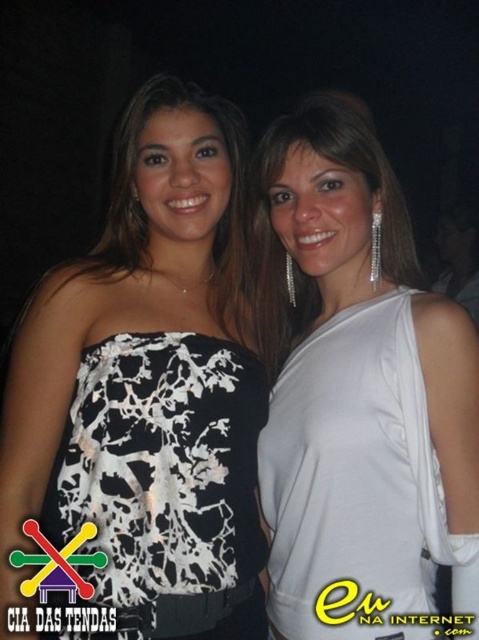
In the scene shown: Which of these two, white printed dress at center or white satin dress at center, stands shorter?

white satin dress at center is shorter.

Does white printed dress at center have a lesser height compared to white satin dress at center?

Incorrect, white printed dress at center's height does not fall short of white satin dress at center's.

Between point (59, 451) and point (269, 266), which one is positioned in front?

Positioned in front is point (59, 451).

The height and width of the screenshot is (640, 479). Identify the location of white printed dress at center. (146, 396).

Is white printed dress at center thinner than white printed dress at left?

No.

Is point (34, 349) positioned behind point (133, 220)?

No, (34, 349) is in front of (133, 220).

Is point (214, 108) behind point (162, 224)?

That is True.

Locate an element on the screen. This screenshot has width=479, height=640. white printed dress at center is located at coordinates coord(146,396).

Between white satin dress at center and white printed fabric dress at left, which one has less height?

With less height is white printed fabric dress at left.

Consider the image. Does white satin dress at center appear under white printed fabric dress at left?

No, white satin dress at center is not below white printed fabric dress at left.

Describe the element at coordinates (355, 388) in the screenshot. The height and width of the screenshot is (640, 479). I see `white satin dress at center` at that location.

Locate an element on the screen. white satin dress at center is located at coordinates (355, 388).